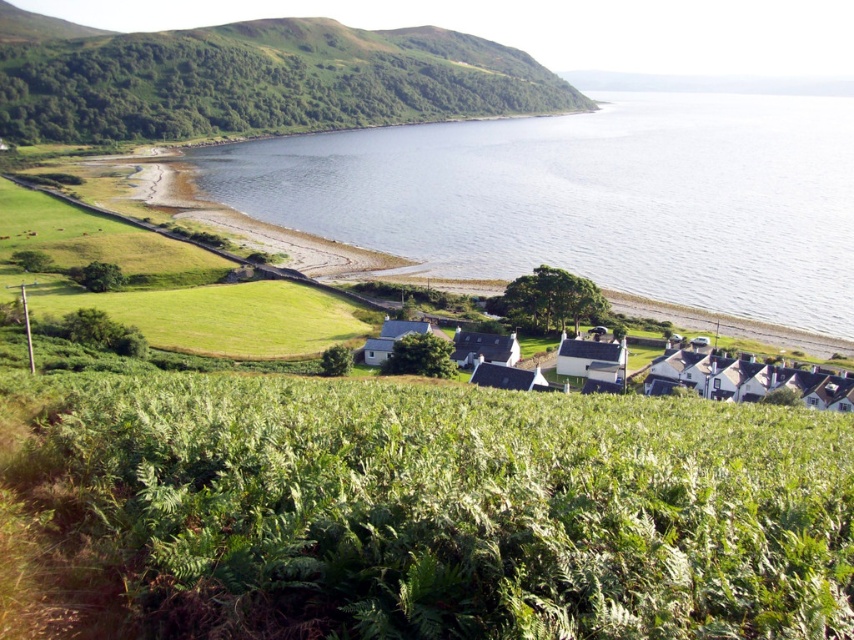
Measure the distance from green grassy hillside at upper left to white wooden houses at center.

green grassy hillside at upper left is 500.23 meters from white wooden houses at center.

From the picture: Is green grassy hillside at upper left shorter than white wooden houses at center?

No.

Measure the distance between point (244,100) and camera.

A distance of 507.69 meters exists between point (244,100) and camera.

Identify the location of green grassy hillside at upper left. pos(254,77).

Who is positioned more to the right, green leafy vineyard at lower center or white wooden houses at center?

white wooden houses at center is more to the right.

Is green leafy vineyard at lower center to the right of white wooden houses at center from the viewer's perspective?

No, green leafy vineyard at lower center is not to the right of white wooden houses at center.

Locate an element on the screen. Image resolution: width=854 pixels, height=640 pixels. green leafy vineyard at lower center is located at coordinates (452, 509).

This screenshot has height=640, width=854. In order to click on green leafy vineyard at lower center in this screenshot , I will do `click(452, 509)`.

Does green leafy vineyard at lower center have a lesser height compared to clear blue water at center?

Correct, green leafy vineyard at lower center is not as tall as clear blue water at center.

Image resolution: width=854 pixels, height=640 pixels. What do you see at coordinates (452, 509) in the screenshot? I see `green leafy vineyard at lower center` at bounding box center [452, 509].

Is point (486, 474) positioned after point (817, 260)?

No.

The image size is (854, 640). I want to click on green leafy vineyard at lower center, so click(x=452, y=509).